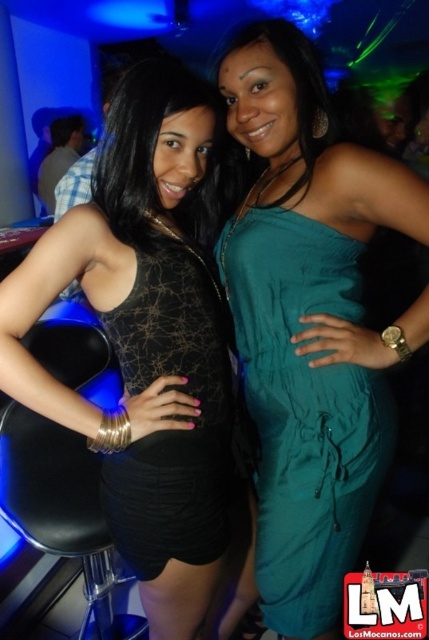
You are a photographer at a nightclub event and need to position two models wearing the matte black dress at center and the black mesh dress at center side by side. Given that the stage width is exactly 1.5 meters, will both dresses fit without overlapping if placed next to each other?

The matte black dress at center is wider than the black mesh dress at center. Since the stage width is 1.5 meters, but the combined width of both dresses is not specified, it is uncertain if they will fit without overlapping. Additional information about each dress width is needed to determine this.

Consider the image. You are a photographer setting up for a photoshoot in a nightclub. You need to position two models wearing the teal fabric jumpsuit at center and the black mesh dress at center so that they are exactly 10 inches apart. Based on their current positions, do you need to move them closer or farther apart?

The teal fabric jumpsuit at center is currently 8.53 inches from the black mesh dress at center. To reach the desired 10 inches, you need to move them farther apart by approximately 1.47 inches.

You are a photographer at a nightclub event. You need to position two models for a photo shoot. The models are wearing the teal fabric jumpsuit at center and the black mesh dress at center. According to the scene, which model should you place on the right side to maintain their original positions?

The teal fabric jumpsuit at center should be placed on the right side because it is already positioned to the right of the black mesh dress at center in the original scene.